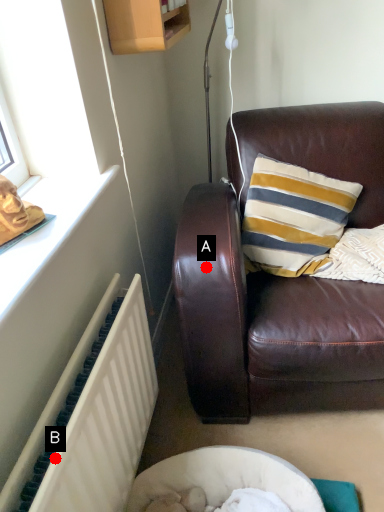
Question: Two points are circled on the image, labeled by A and B beside each circle. Which point is farther from the camera taking this photo?

Choices:
 (A) A is further
 (B) B is further

Answer: (A)